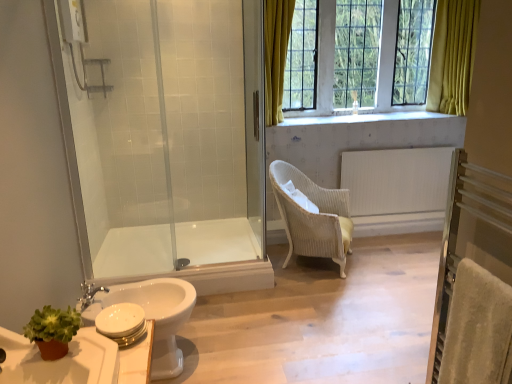
Question: From a real-world perspective, is green matte plant at lower left positioned under white glossy toilet at lower left based on gravity?

Choices:
 (A) no
 (B) yes

Answer: (A)

Question: Considering the relative sizes of green matte plant at lower left and white glossy toilet at lower left in the image provided, is green matte plant at lower left thinner than white glossy toilet at lower left?

Choices:
 (A) no
 (B) yes

Answer: (B)

Question: From the image's perspective, is green matte plant at lower left located beneath white glossy toilet at lower left?

Choices:
 (A) yes
 (B) no

Answer: (B)

Question: Is green matte plant at lower left closer to camera compared to white glossy toilet at lower left?

Choices:
 (A) yes
 (B) no

Answer: (A)

Question: Would you consider green matte plant at lower left to be distant from white glossy toilet at lower left?

Choices:
 (A) no
 (B) yes

Answer: (A)

Question: Is point 168,67 positioned closer to the camera than point 130,319?

Choices:
 (A) farther
 (B) closer

Answer: (A)

Question: Is transparent glass shower door at left spatially inside white matte toilet paper at lower left, or outside of it?

Choices:
 (A) inside
 (B) outside

Answer: (B)

Question: Looking at their shapes, would you say transparent glass shower door at left is wider or thinner than white matte toilet paper at lower left?

Choices:
 (A) thin
 (B) wide

Answer: (A)

Question: From a real-world perspective, is transparent glass shower door at left above or below white matte toilet paper at lower left?

Choices:
 (A) below
 (B) above

Answer: (B)

Question: Relative to clear glass shower door at center, is silver metallic faucet at lower left in front or behind?

Choices:
 (A) front
 (B) behind

Answer: (A)

Question: From the image's perspective, is silver metallic faucet at lower left positioned above or below clear glass shower door at center?

Choices:
 (A) below
 (B) above

Answer: (A)

Question: Looking at their shapes, would you say silver metallic faucet at lower left is wider or thinner than clear glass shower door at center?

Choices:
 (A) wide
 (B) thin

Answer: (A)

Question: Is silver metallic faucet at lower left situated inside clear glass shower door at center or outside?

Choices:
 (A) outside
 (B) inside

Answer: (A)

Question: In terms of width, does white glossy toilet at lower left look wider or thinner when compared to beige wicker chair at center?

Choices:
 (A) wide
 (B) thin

Answer: (B)

Question: From the image's perspective, is white glossy toilet at lower left above or below beige wicker chair at center?

Choices:
 (A) above
 (B) below

Answer: (B)